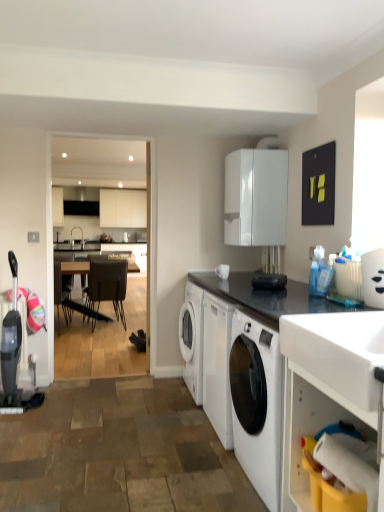
Question: Which direction should I rotate to look at leather-like dark brown chair at center, which appears as the 1th chair when viewed from the right, — up or down?

Choices:
 (A) up
 (B) down

Answer: (B)

Question: Can you confirm if dark brown leather chair at center, which is the 2th chair in right-to-left order, is positioned to the right of white glossy cabinet at upper center?

Choices:
 (A) yes
 (B) no

Answer: (B)

Question: Is dark brown leather chair at center, the first chair when ordered from left to right, taller than white glossy cabinet at upper center?

Choices:
 (A) no
 (B) yes

Answer: (B)

Question: Does dark brown leather chair at center, the first chair when ordered from left to right, have a greater width compared to white glossy cabinet at upper center?

Choices:
 (A) yes
 (B) no

Answer: (A)

Question: Is dark brown leather chair at center, the 1th chair in the back-to-front sequence, smaller than white glossy cabinet at upper center?

Choices:
 (A) yes
 (B) no

Answer: (B)

Question: Does dark brown leather chair at center, the first chair when ordered from left to right, have a larger size compared to white glossy cabinet at upper center?

Choices:
 (A) yes
 (B) no

Answer: (A)

Question: Can you confirm if dark brown leather chair at center, placed as the 2th chair when sorted from front to back, is positioned to the left of white glossy cabinet at upper center?

Choices:
 (A) no
 (B) yes

Answer: (B)

Question: Is leather-like dark brown chair at center, which appears as the 1th chair when viewed from the right, aimed at white glossy countertop at lower right, the 2th countertop viewed from the top?

Choices:
 (A) yes
 (B) no

Answer: (B)

Question: Considering the relative positions of leather-like dark brown chair at center, the second chair in the left-to-right sequence, and white glossy countertop at lower right, the 1th countertop in the bottom-to-top sequence, in the image provided, is leather-like dark brown chair at center, the second chair in the left-to-right sequence, to the left of white glossy countertop at lower right, the 1th countertop in the bottom-to-top sequence, from the viewer's perspective?

Choices:
 (A) yes
 (B) no

Answer: (A)

Question: From a real-world perspective, does leather-like dark brown chair at center, the second chair in the left-to-right sequence, stand above white glossy countertop at lower right, the 1th countertop in the bottom-to-top sequence?

Choices:
 (A) yes
 (B) no

Answer: (A)

Question: Does leather-like dark brown chair at center, which ranks as the 1th chair in front-to-back order, come in front of white glossy countertop at lower right, the 2th countertop viewed from the top?

Choices:
 (A) no
 (B) yes

Answer: (A)

Question: Could white glossy countertop at lower right, the 2th countertop viewed from the top, be considered to be inside leather-like dark brown chair at center, which appears as the 1th chair when viewed from the right?

Choices:
 (A) yes
 (B) no

Answer: (B)

Question: Considering the relative positions of leather-like dark brown chair at center, which ranks as the 1th chair in front-to-back order, and white glossy countertop at lower right, the 1th countertop in the bottom-to-top sequence, in the image provided, is leather-like dark brown chair at center, which ranks as the 1th chair in front-to-back order, to the right of white glossy countertop at lower right, the 1th countertop in the bottom-to-top sequence, from the viewer's perspective?

Choices:
 (A) no
 (B) yes

Answer: (A)

Question: Is dark brown leather chair at center, placed as the 2th chair when sorted from front to back, facing towards leather-like dark brown chair at center, which appears as the 1th chair when viewed from the right?

Choices:
 (A) no
 (B) yes

Answer: (A)